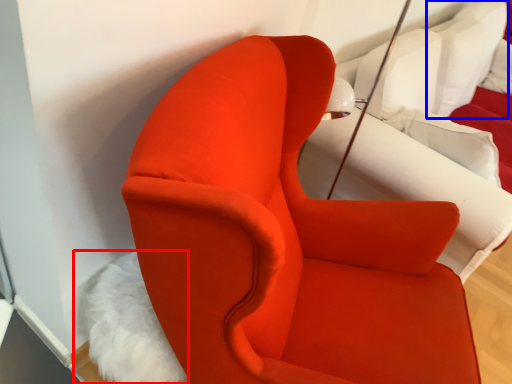
Question: Which object appears farthest to the camera in this image, animal (highlighted by a red box) or pillow (highlighted by a blue box)?

Choices:
 (A) animal
 (B) pillow

Answer: (B)